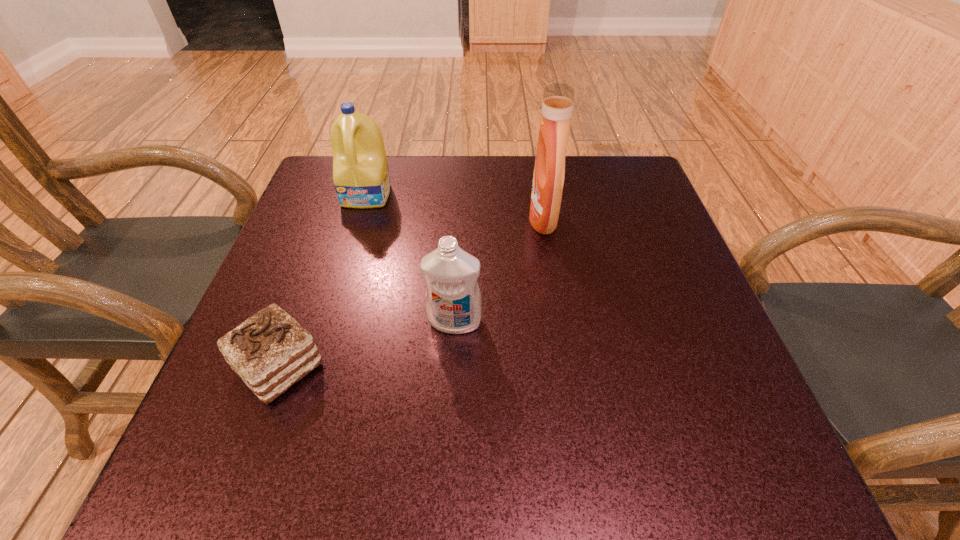
Find the location of a particular element. The image size is (960, 540). vacant space at the near right corner of the desktop is located at coordinates (686, 477).

You are a GUI agent. You are given a task and a screenshot of the screen. Output one action in this format:
    pyautogui.click(x=<x>, y=<y>)
    Task: Click on the free space between the leftmost detergent and the shortest object
    
    Given the screenshot: What is the action you would take?
    pyautogui.click(x=324, y=281)

The image size is (960, 540). Identify the location of unoccupied position between the shortest object and the leftmost detergent. (324, 281).

You are a GUI agent. You are given a task and a screenshot of the screen. Output one action in this format:
    pyautogui.click(x=<x>, y=<y>)
    Task: Click on the unoccupied area between the rightmost detergent and the leftmost detergent
    
    Given the screenshot: What is the action you would take?
    pyautogui.click(x=455, y=207)

The width and height of the screenshot is (960, 540). Identify the location of free spot between the nearest detergent and the tallest object. (499, 270).

At what (x,y) coordinates should I click in order to perform the action: click on vacant space that's between the third object from left to right and the leftmost detergent. Please return your answer as a coordinate pair (x, y). Looking at the image, I should click on pyautogui.click(x=411, y=258).

Where is `vacant space that is in between the chocolate cake and the tallest detergent`? vacant space that is in between the chocolate cake and the tallest detergent is located at coordinates (411, 293).

Image resolution: width=960 pixels, height=540 pixels. Identify the location of vacant region between the nearest detergent and the shortest object. (367, 345).

In order to click on vacant area that lies between the tallest detergent and the nearest detergent in this screenshot , I will do `click(499, 270)`.

Where is `free space between the tallest detergent and the second detergent from left to right`? Image resolution: width=960 pixels, height=540 pixels. free space between the tallest detergent and the second detergent from left to right is located at coordinates (499, 270).